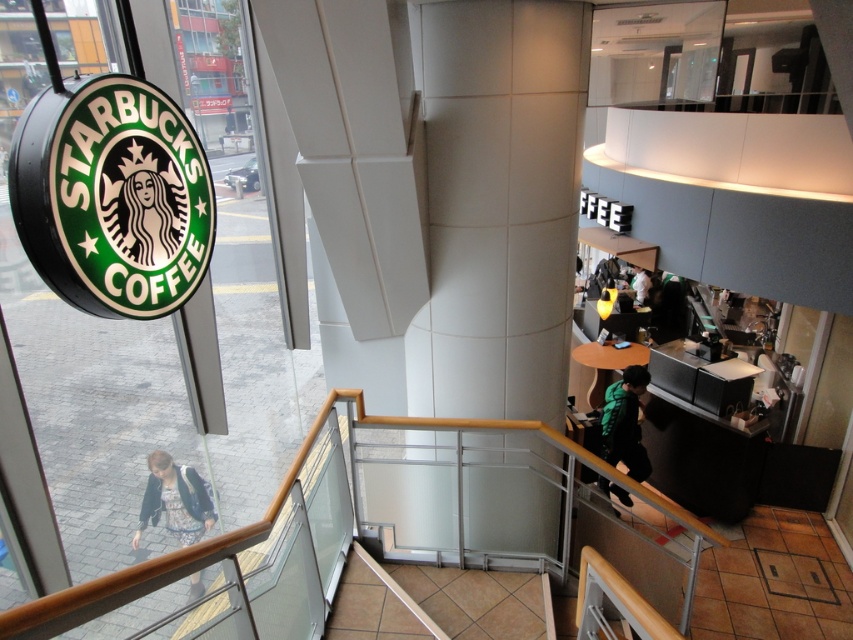
Question: Does white tile pillar at center have a smaller size compared to green textured jacket at lower right?

Choices:
 (A) yes
 (B) no

Answer: (B)

Question: Which object appears farthest from the camera in this image?

Choices:
 (A) green textured jacket at lower right
 (B) denim jacket at lower left

Answer: (B)

Question: Which is nearer to the white tile pillar at center?

Choices:
 (A) denim jacket at lower left
 (B) green textured jacket at lower right

Answer: (B)

Question: Can you confirm if white tile pillar at center is positioned to the right of green textured jacket at lower right?

Choices:
 (A) no
 (B) yes

Answer: (A)

Question: Which of these objects is positioned farthest from the denim jacket at lower left?

Choices:
 (A) green textured jacket at lower right
 (B) white tile pillar at center

Answer: (B)

Question: Does white tile pillar at center come behind green textured jacket at lower right?

Choices:
 (A) no
 (B) yes

Answer: (A)